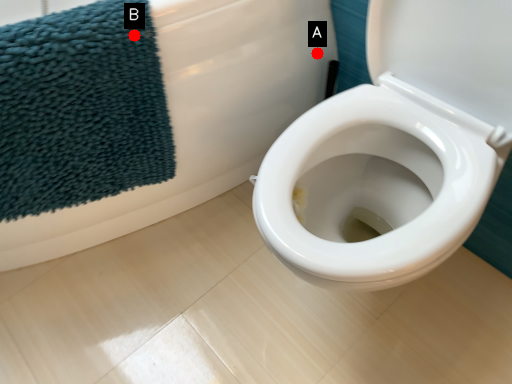
Question: Two points are circled on the image, labeled by A and B beside each circle. Among these points, which one is nearest to the camera?

Choices:
 (A) A is closer
 (B) B is closer

Answer: (B)